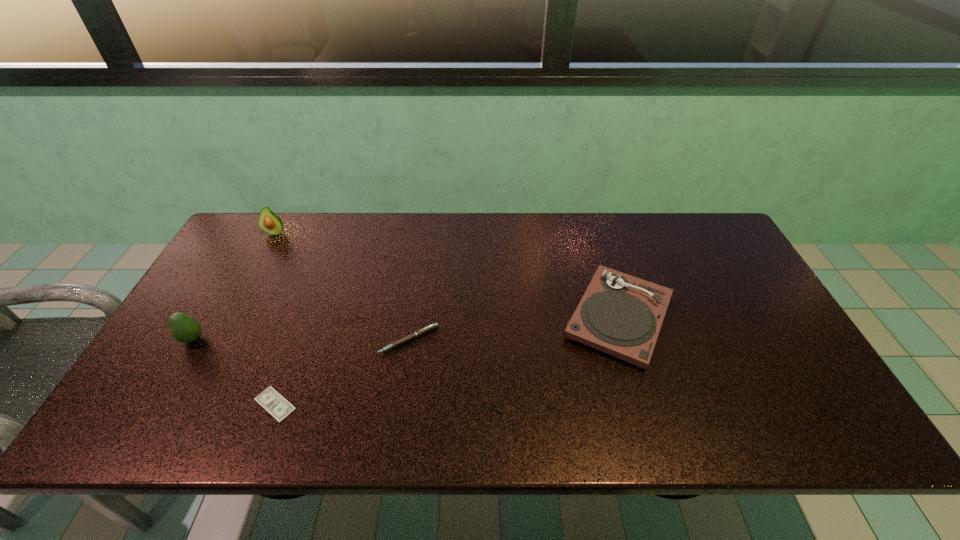
Find the location of a particular element. The width and height of the screenshot is (960, 540). free location located 0.280m on the right of the shorter avocado is located at coordinates (312, 340).

Where is `free space located on the left of the rightmost object`? free space located on the left of the rightmost object is located at coordinates (461, 318).

I want to click on free region located at the nib of the fourth tallest object, so pyautogui.click(x=396, y=429).

Image resolution: width=960 pixels, height=540 pixels. I want to click on vacant area located 0.120m on the left of the money, so click(201, 404).

Where is `object that is at the far edge`? The image size is (960, 540). object that is at the far edge is located at coordinates (269, 222).

This screenshot has width=960, height=540. I want to click on object present at the near edge, so click(x=269, y=399).

Locate an element on the screen. The width and height of the screenshot is (960, 540). object that is positioned at the far left corner is located at coordinates (269, 222).

At what (x,y) coordinates should I click in order to perform the action: click on free space at the far edge. Please return your answer as a coordinate pair (x, y). Looking at the image, I should click on (512, 230).

Identify the location of vacant space at the near edge. (732, 419).

The height and width of the screenshot is (540, 960). Identify the location of vacant region at the left edge of the desktop. (238, 272).